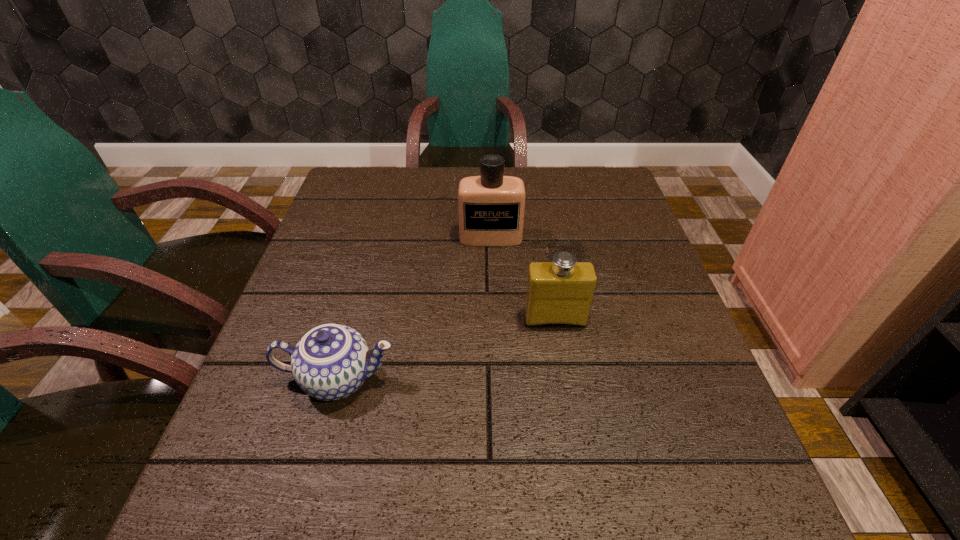
The width and height of the screenshot is (960, 540). Find the location of `the farther perfume`. the farther perfume is located at coordinates (491, 207).

I want to click on the nearer perfume, so click(559, 292).

This screenshot has width=960, height=540. In order to click on chinaware in this screenshot , I will do `click(330, 362)`.

You are a GUI agent. You are given a task and a screenshot of the screen. Output one action in this format:
    pyautogui.click(x=<x>, y=<y>)
    Task: Click on the shortest object
    This screenshot has width=960, height=540.
    Given the screenshot: What is the action you would take?
    pyautogui.click(x=330, y=362)

Identify the location of free space located 0.340m on the front label of the farthest object. This screenshot has height=540, width=960. (494, 363).

The height and width of the screenshot is (540, 960). Identify the location of free space located on the front-facing side of the nearer perfume. (583, 490).

The width and height of the screenshot is (960, 540). I want to click on blank space located at the spout of the nearest object, so pos(599,379).

Identify the location of object situated at the left edge. The width and height of the screenshot is (960, 540). (330, 362).

Locate an element on the screen. The image size is (960, 540). free space at the far edge of the desktop is located at coordinates (436, 198).

In the image, there is a desktop. Identify the location of free space at the near edge. (487, 536).